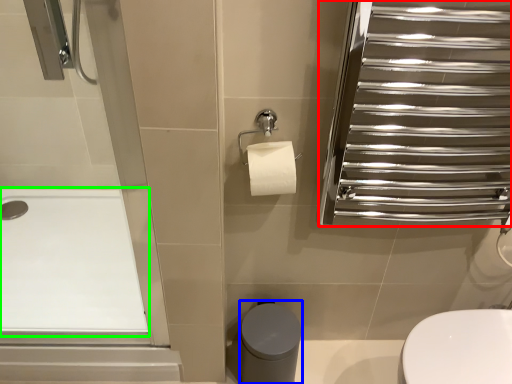
Question: Based on their relative distances, which object is farther from screen door (highlighted by a red box)? Choose from bidet (highlighted by a blue box) and bath (highlighted by a green box).

Choices:
 (A) bidet
 (B) bath

Answer: (B)